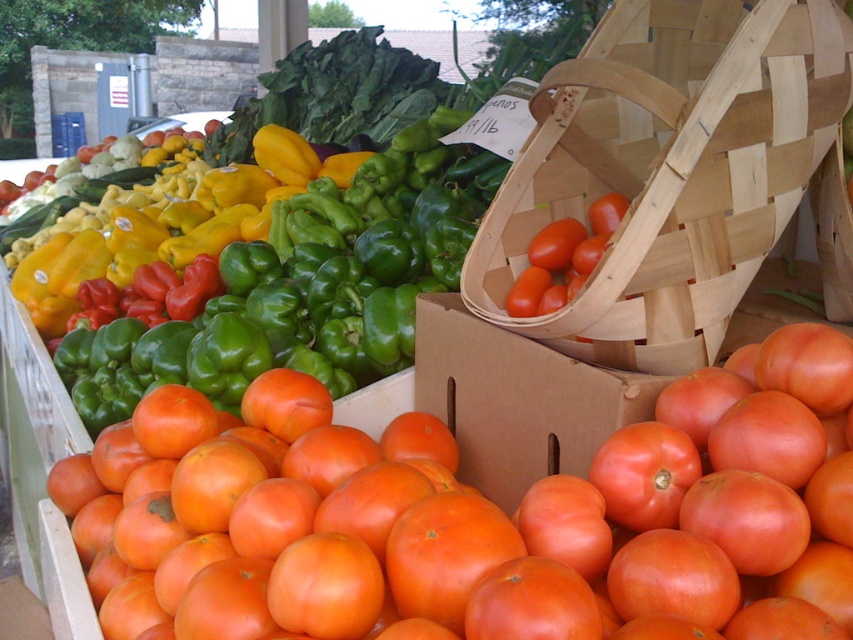
Question: Can you confirm if green matte bell pepper at center is positioned to the left of cardboard box at right?

Choices:
 (A) no
 (B) yes

Answer: (B)

Question: Which of the following is the closest to the observer?

Choices:
 (A) (239, 289)
 (B) (271, 611)
 (C) (618, 416)

Answer: (B)

Question: Can you confirm if wooden woven basket at upper center is positioned below cardboard box at right?

Choices:
 (A) yes
 (B) no

Answer: (B)

Question: Among these objects, which one is nearest to the camera?

Choices:
 (A) wooden woven basket at upper center
 (B) cardboard box at right
 (C) shiny red tomato at center

Answer: (A)

Question: Which object is the closest to the green matte bell pepper at center?

Choices:
 (A) shiny red tomato at center
 (B) wooden woven basket at upper center
 (C) smooth orange tomato at center

Answer: (B)

Question: Does cardboard box at right have a larger size compared to shiny red tomato at center?

Choices:
 (A) yes
 (B) no

Answer: (A)